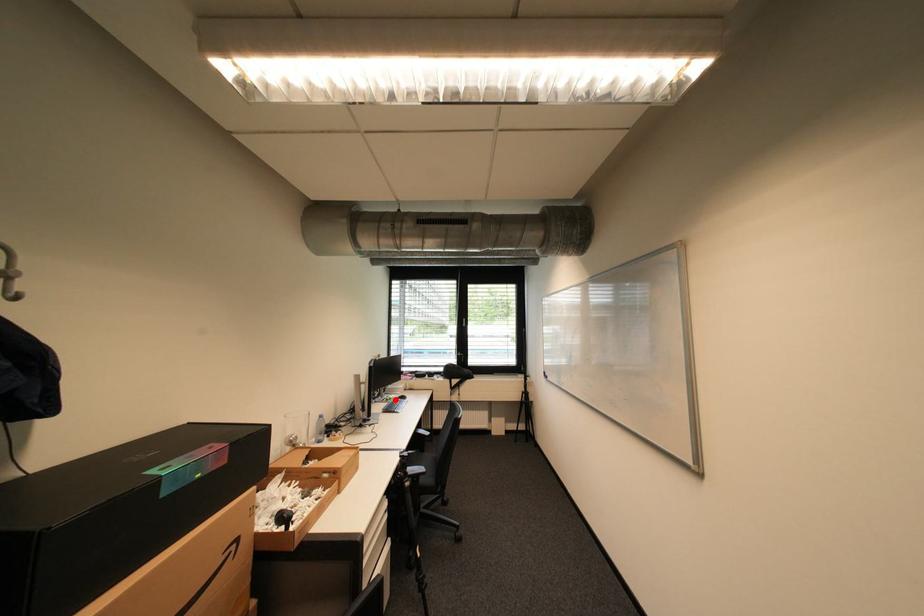
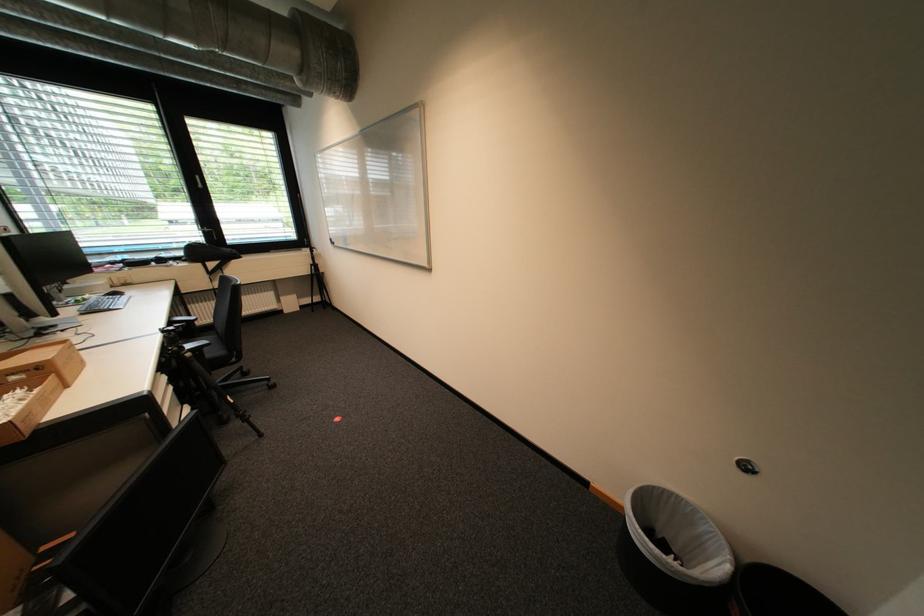
In the second image, find the point that corresponds to the highlighted location in the first image.

(86, 302)